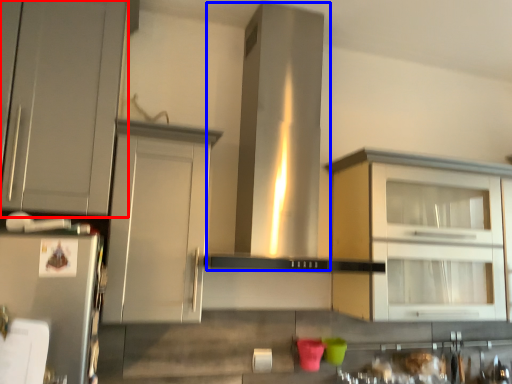
Question: Which object appears closest to the camera in this image, cabinetry (highlighted by a red box) or vent (highlighted by a blue box)?

Choices:
 (A) cabinetry
 (B) vent

Answer: (A)